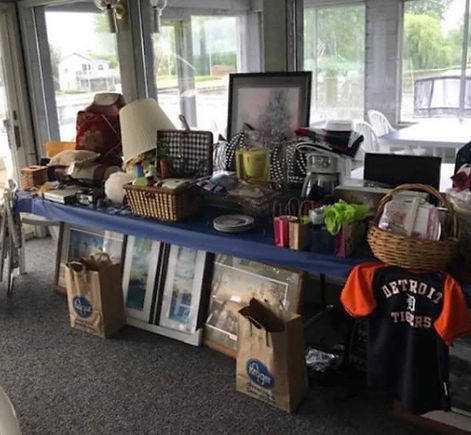
I want to click on plates, so click(234, 222).